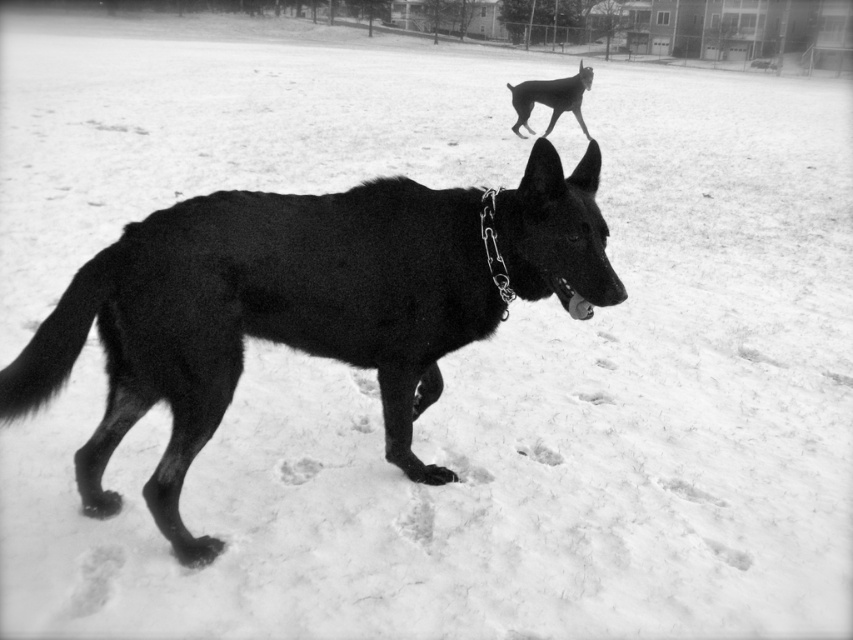
How far apart are black chain-link collar at center and shiny black dog at upper center?

black chain-link collar at center is 30.03 feet away from shiny black dog at upper center.

Does point (416, 193) lie in front of point (534, 92)?

That is True.

What do you see at coordinates (262, 317) in the screenshot? I see `black chain-link collar at center` at bounding box center [262, 317].

Identify the location of black chain-link collar at center. (262, 317).

Does point (418, 288) lie behind point (506, 282)?

Yes, point (418, 288) is farther from viewer.

Between black chain-link collar at center and metallic chain at center, which one appears on the right side from the viewer's perspective?

metallic chain at center is more to the right.

Is point (415, 362) positioned before point (492, 209)?

No, it is behind (492, 209).

Find the location of a particular element. Image resolution: width=853 pixels, height=640 pixels. black chain-link collar at center is located at coordinates (262, 317).

Is shiny black dog at upper center below metallic chain at center?

No.

Which is in front, point (544, 90) or point (509, 292)?

Point (509, 292)

Image resolution: width=853 pixels, height=640 pixels. What do you see at coordinates (550, 99) in the screenshot? I see `shiny black dog at upper center` at bounding box center [550, 99].

What are the coordinates of `shiny black dog at upper center` in the screenshot? It's located at (550, 99).